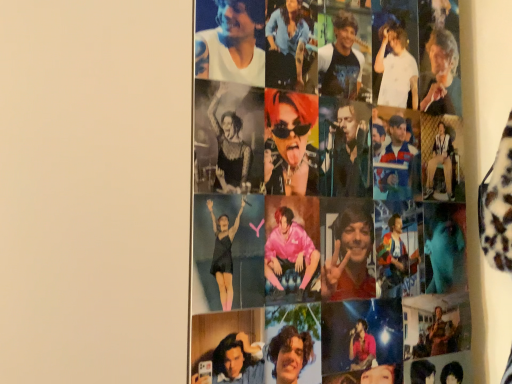
Image resolution: width=512 pixels, height=384 pixels. I want to click on printed collage of photos at center, so click(x=315, y=191).

The height and width of the screenshot is (384, 512). What do you see at coordinates (315, 191) in the screenshot?
I see `printed collage of photos at center` at bounding box center [315, 191].

Where is `printed collage of photos at center`? printed collage of photos at center is located at coordinates (315, 191).